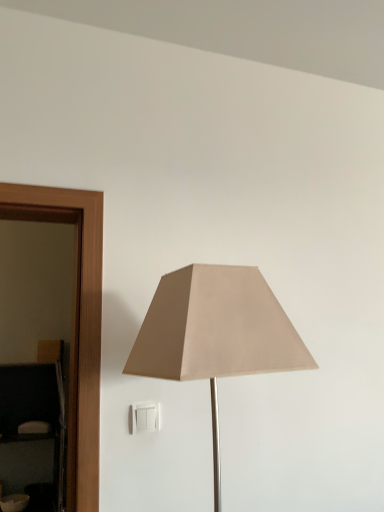
Question: Is matte black dresser at left completely or partially outside of beige fabric lamp at center?

Choices:
 (A) no
 (B) yes

Answer: (B)

Question: Is matte black dresser at left wider than beige fabric lamp at center?

Choices:
 (A) yes
 (B) no

Answer: (B)

Question: Considering the relative positions of matte black dresser at left and beige fabric lamp at center in the image provided, is matte black dresser at left to the left of beige fabric lamp at center from the viewer's perspective?

Choices:
 (A) yes
 (B) no

Answer: (A)

Question: Is matte black dresser at left facing towards beige fabric lamp at center?

Choices:
 (A) yes
 (B) no

Answer: (B)

Question: Is matte black dresser at left bigger than beige fabric lamp at center?

Choices:
 (A) yes
 (B) no

Answer: (B)

Question: From a real-world perspective, is matte black dresser at left located higher than beige fabric lamp at center?

Choices:
 (A) yes
 (B) no

Answer: (B)

Question: Considering the relative sizes of white plastic/light switch at lower center and matte black dresser at left in the image provided, is white plastic/light switch at lower center thinner than matte black dresser at left?

Choices:
 (A) yes
 (B) no

Answer: (A)

Question: Can you confirm if white plastic/light switch at lower center is shorter than matte black dresser at left?

Choices:
 (A) no
 (B) yes

Answer: (B)

Question: From the image's perspective, is white plastic/light switch at lower center beneath matte black dresser at left?

Choices:
 (A) no
 (B) yes

Answer: (A)

Question: Would you consider white plastic/light switch at lower center to be distant from matte black dresser at left?

Choices:
 (A) yes
 (B) no

Answer: (A)

Question: Would you say white plastic/light switch at lower center contains matte black dresser at left?

Choices:
 (A) no
 (B) yes

Answer: (A)

Question: Is white plastic/light switch at lower center bigger than matte black dresser at left?

Choices:
 (A) yes
 (B) no

Answer: (B)

Question: Would you say beige fabric lamp at center contains matte black dresser at left?

Choices:
 (A) no
 (B) yes

Answer: (A)